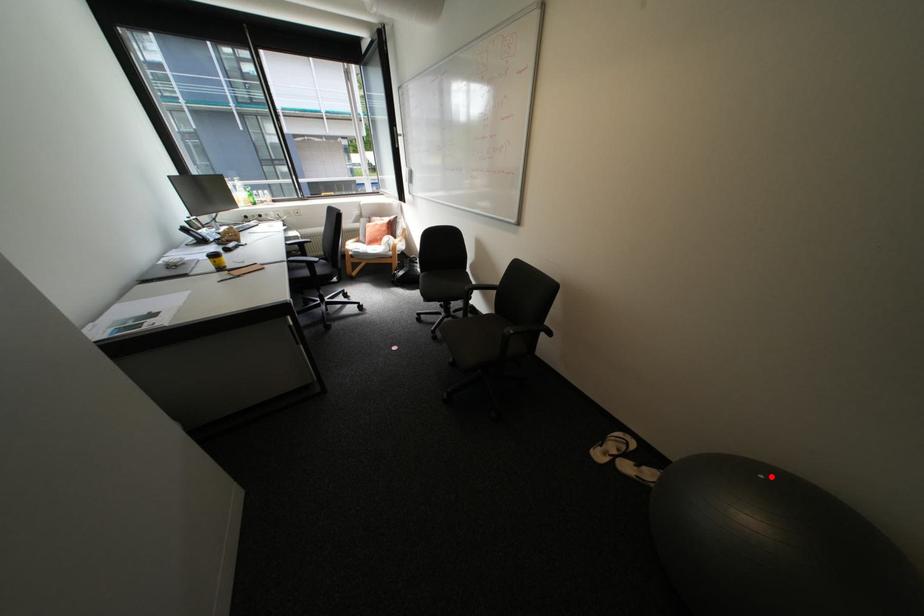
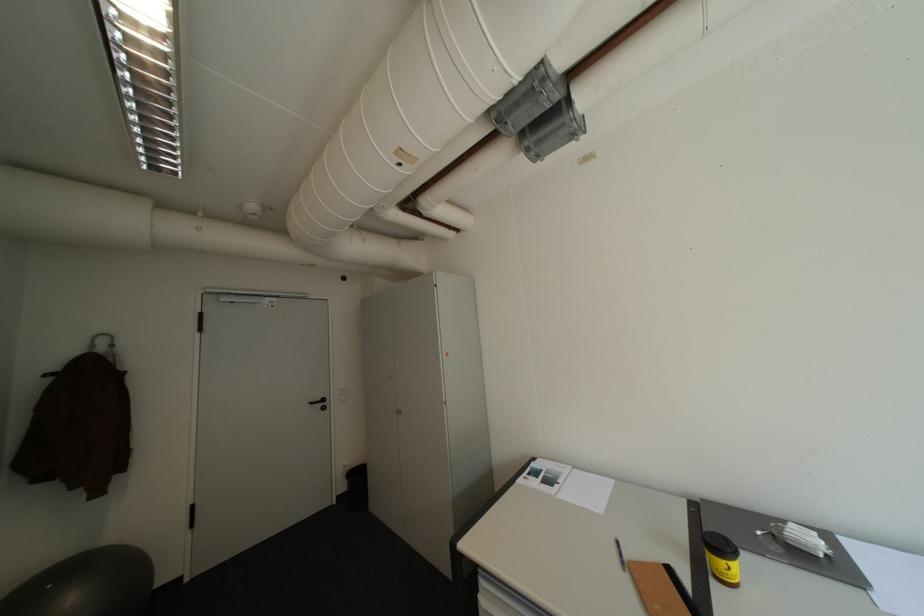
Question: I am providing you with two images of the same scene from different viewpoints. In image1, a red point is highlighted. Considering the same 3D point in image2, which of the following is correct?

Choices:
 (A) It is closer
 (B) It is farther

Answer: (B)